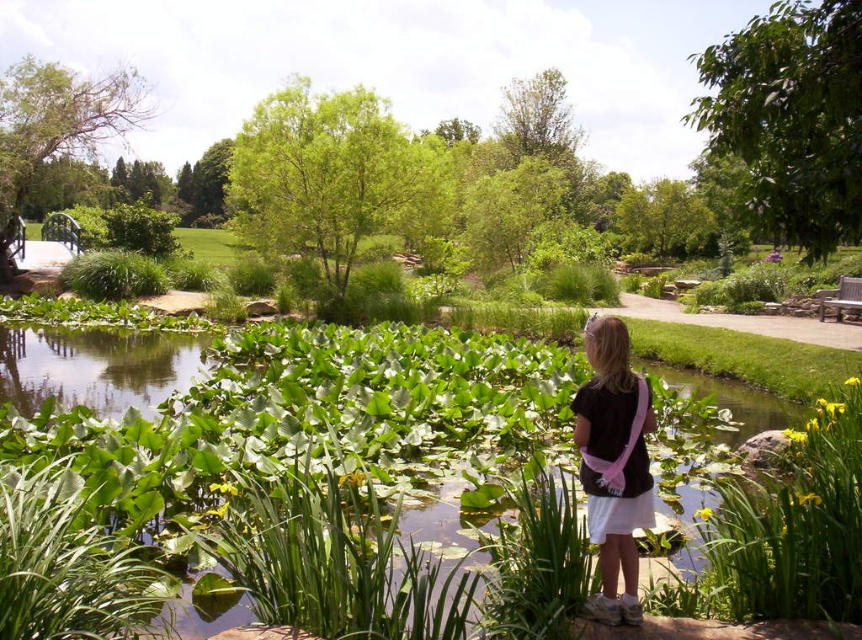
Question: Can you confirm if green leafy water at center is wider than black matte shirt at center?

Choices:
 (A) no
 (B) yes

Answer: (B)

Question: Is green leafy water at center smaller than black matte shirt at center?

Choices:
 (A) no
 (B) yes

Answer: (A)

Question: Does green leafy water at center appear on the left side of black matte shirt at center?

Choices:
 (A) yes
 (B) no

Answer: (A)

Question: Which point is farther from the camera taking this photo?

Choices:
 (A) (635, 586)
 (B) (484, 352)

Answer: (B)